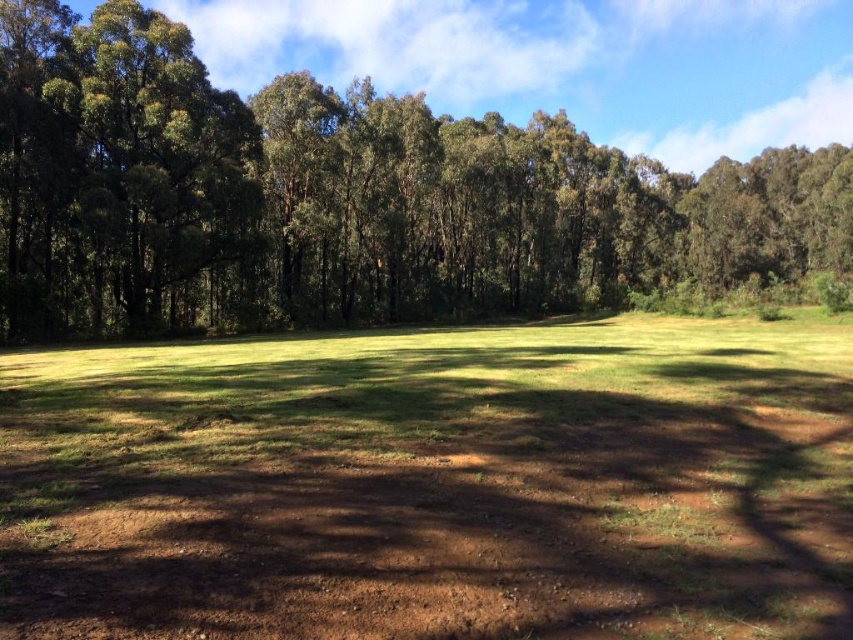
You are standing at the starting point of the dirt path in the grassy area. You see two points marked on the ground ahead of you. The first point is at coordinates point (138, 611) and the second point is at point (167, 266). Which point is closer to you as you face the dirt path?

Point (138, 611) is in front of point (167, 266), so the first point is closer to you.

You are standing at the edge of the grassy area and want to walk to the dirt path. Which object, the brown dirt field at center or the green leafy tree at center, is narrower in width?

The brown dirt field at center is thinner than the green leafy tree at center, so the brown dirt field at center is narrower in width.

You are standing on the brown dirt field at center and want to see the top of the green leafy tree at center. Can you see the top without moving your position?

The green leafy tree at center is taller than the brown dirt field at center, so yes, you can see the top of the green leafy tree at center from your current position on the brown dirt field at center.